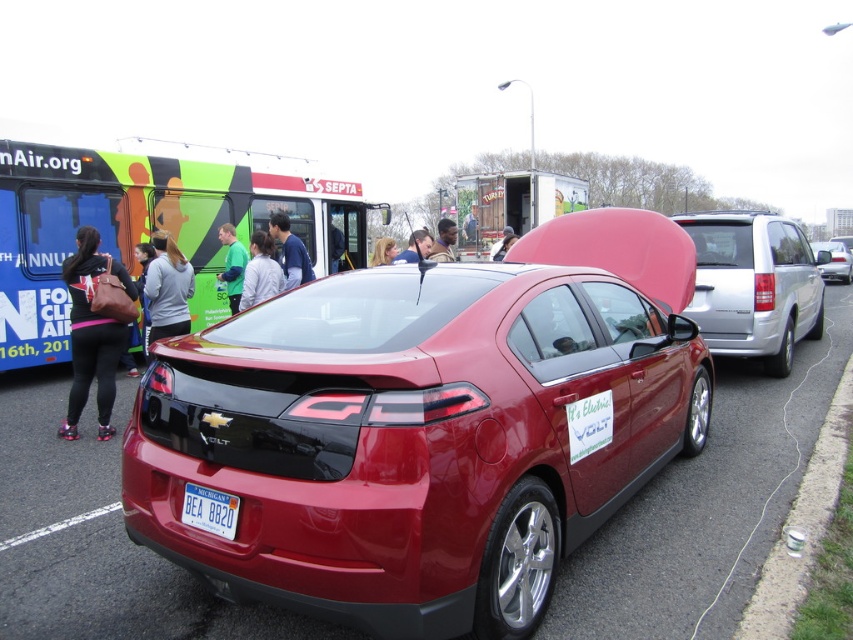
Is gray fabric jacket at center behind smooth skin face at center?

No, it is not.

Based on the photo, measure the distance between point (248, 288) and camera.

7.17 meters

Is point (251, 275) positioned behind point (392, 260)?

No, (251, 275) is in front of (392, 260).

Identify the location of gray fabric jacket at center. (260, 272).

Is green matte bus at upper left smaller than matte black backpack at left?

Indeed, green matte bus at upper left has a smaller size compared to matte black backpack at left.

Is green matte bus at upper left below matte black backpack at left?

No, green matte bus at upper left is not below matte black backpack at left.

Is point (33, 204) more distant than point (91, 372)?

Yes, point (33, 204) is farther from viewer.

Where is `green matte bus at upper left`? The height and width of the screenshot is (640, 853). green matte bus at upper left is located at coordinates (144, 227).

Between point (776, 237) and point (239, 241), which one is positioned behind?

Point (239, 241)

Is silver metallic minivan at right further to camera compared to green fleece jacket at center?

That is False.

Between point (773, 308) and point (235, 300), which one is positioned in front?

Point (773, 308)

At what (x,y) coordinates should I click in order to perform the action: click on silver metallic minivan at right. Please return your answer as a coordinate pair (x, y). Looking at the image, I should click on (753, 285).